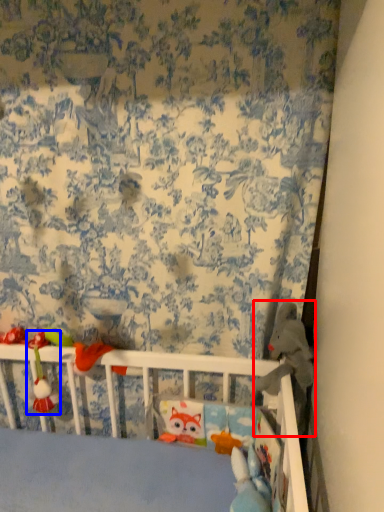
Question: Which object is closer to the camera taking this photo, toy (highlighted by a red box) or toy (highlighted by a blue box)?

Choices:
 (A) toy
 (B) toy

Answer: (A)